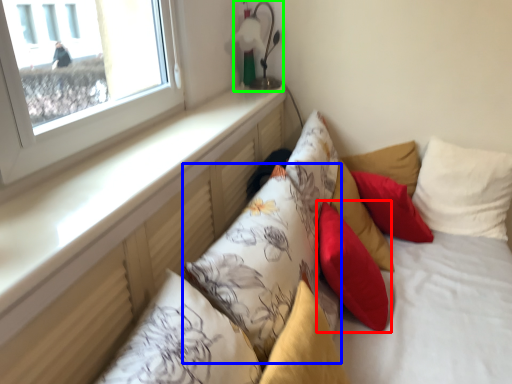
Question: Which is nearer to the pillow (highlighted by a red box)? pillow (highlighted by a blue box) or table lamp (highlighted by a green box).

Choices:
 (A) pillow
 (B) table lamp

Answer: (A)